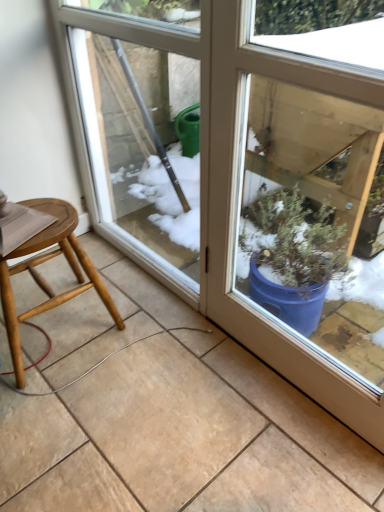
Question: From their relative heights in the image, would you say light wood stool at lower left is taller or shorter than transparent glass screen door at center?

Choices:
 (A) tall
 (B) short

Answer: (B)

Question: Considering their positions, is light wood stool at lower left located in front of or behind transparent glass screen door at center?

Choices:
 (A) behind
 (B) front

Answer: (A)

Question: In terms of size, does light wood stool at lower left appear bigger or smaller than transparent glass screen door at center?

Choices:
 (A) big
 (B) small

Answer: (B)

Question: In terms of width, does transparent glass screen door at center look wider or thinner when compared to light wood stool at lower left?

Choices:
 (A) wide
 (B) thin

Answer: (B)

Question: From a real-world perspective, is transparent glass screen door at center above or below light wood stool at lower left?

Choices:
 (A) above
 (B) below

Answer: (A)

Question: In terms of size, does transparent glass screen door at center appear bigger or smaller than light wood stool at lower left?

Choices:
 (A) big
 (B) small

Answer: (A)

Question: From the image's perspective, is transparent glass screen door at center positioned above or below light wood stool at lower left?

Choices:
 (A) below
 (B) above

Answer: (B)